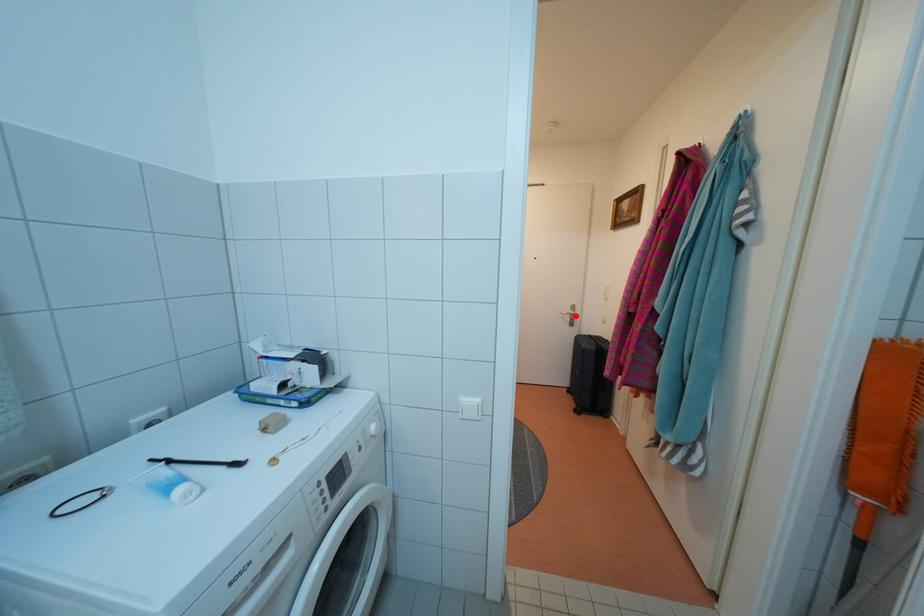
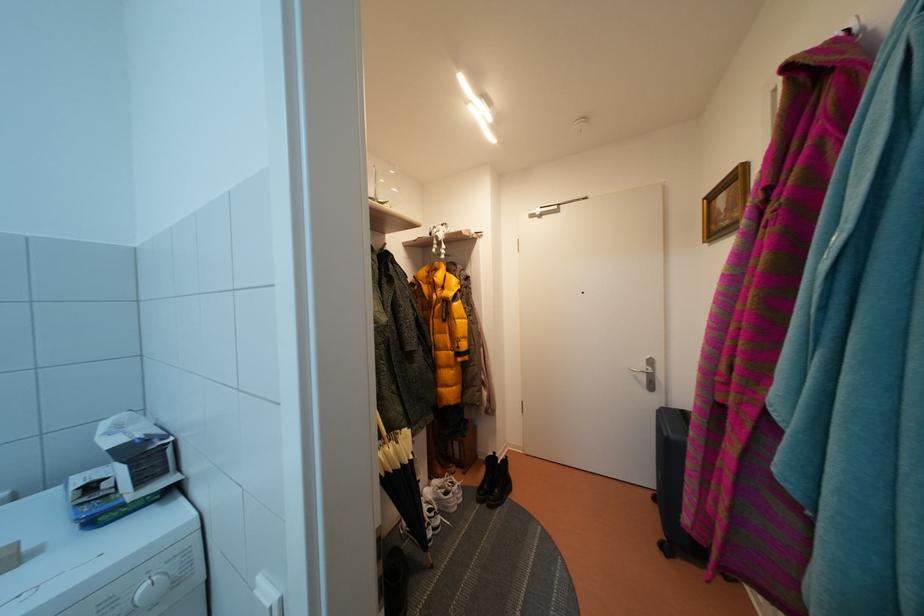
Question: I am providing you with two images of the same scene from different viewpoints. In image1, a red point is highlighted. Considering the same 3D point in image2, which of the following is correct?

Choices:
 (A) It is closer
 (B) It is farther

Answer: (B)